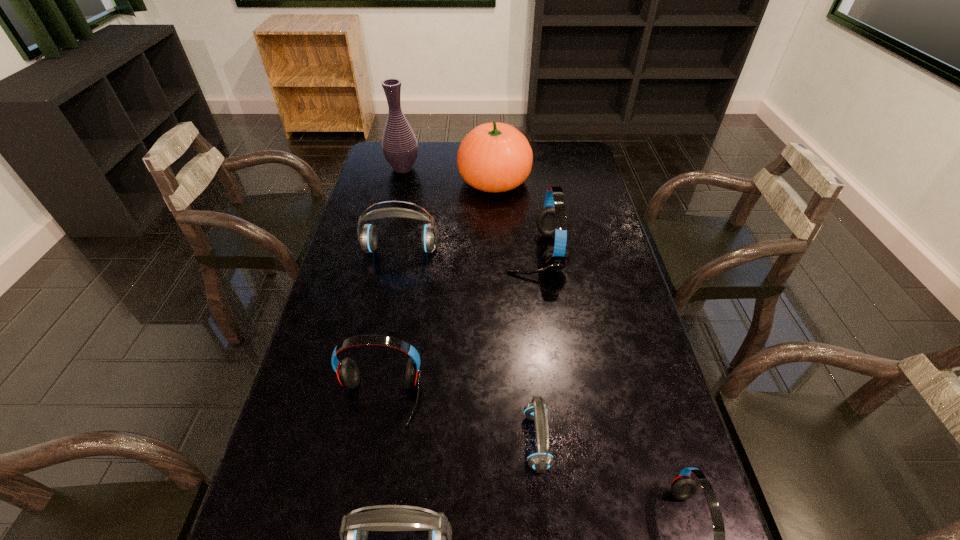
You are a GUI agent. You are given a task and a screenshot of the screen. Output one action in this format:
    pyautogui.click(x=<x>, y=<y>)
    Task: Click on the vacant area situated on the front of the pumpkin
    This screenshot has width=960, height=540.
    Given the screenshot: What is the action you would take?
    pyautogui.click(x=497, y=256)

Where is `vacant area located with the microphone attached to the side of the second red headset from left to right`? The height and width of the screenshot is (540, 960). vacant area located with the microphone attached to the side of the second red headset from left to right is located at coordinates (471, 253).

Image resolution: width=960 pixels, height=540 pixels. In order to click on free location located with the microphone attached to the side of the second red headset from left to right in this screenshot , I will do `click(404, 253)`.

Image resolution: width=960 pixels, height=540 pixels. I want to click on vacant position located 0.340m with the microphone attached to the side of the second red headset from left to right, so click(x=401, y=253).

Where is `vacant space situated on the ear cups of the farthest blue headset`? vacant space situated on the ear cups of the farthest blue headset is located at coordinates (386, 328).

The image size is (960, 540). Find the location of `vacant space located 0.060m with the microphone attached to the side of the second smallest red headset`. vacant space located 0.060m with the microphone attached to the side of the second smallest red headset is located at coordinates (370, 454).

Identify the location of free space located on the ear cups of the smallest blue headset. point(391,441).

Identify the location of free space located 0.350m on the ear cups of the smallest blue headset. The image size is (960, 540). (369, 441).

Locate an element on the screen. Image resolution: width=960 pixels, height=540 pixels. vacant space situated 0.190m on the ear cups of the smallest blue headset is located at coordinates (441, 441).

Image resolution: width=960 pixels, height=540 pixels. I want to click on vase that is at the far edge, so click(x=399, y=144).